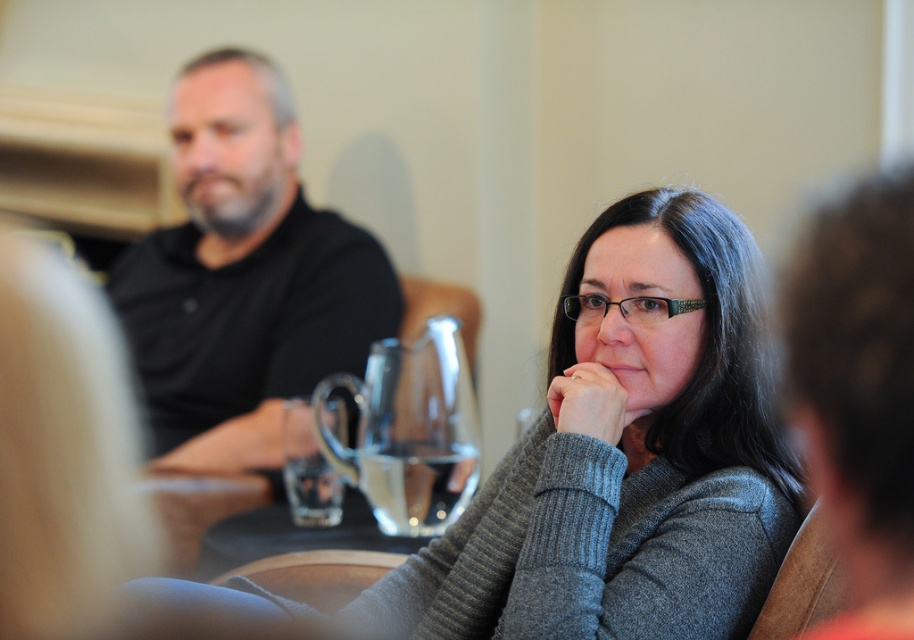
You are a photographer trying to capture a closeup of the transparent glass pitcher at center without including the gray knitted sweater at center in the frame. Based on their positions, is this possible?

The gray knitted sweater at center is to the right of the transparent glass pitcher at center, so if you position your camera to the left side of the pitcher, you can capture the pitcher without including the sweater on the right side.

You are a delivery robot that is 1 meter wide. You need to move from the gray knitted sweater at center to the black matte shirt at upper left. Can you fit through the space between them?

The distance between the gray knitted sweater at center and the black matte shirt at upper left is 1.32 meters. Since the robot is 1 meter wide, it can fit through the space between them as the distance is wider than the robot.

Looking at this image, you are a photographer trying to capture a clear shot of the black matte shirt at upper left and the transparent glass pitcher at center. Which object should you focus on to ensure it appears sharp in the final image?

The black matte shirt at upper left is much taller than the transparent glass pitcher at center, so focusing on the black matte shirt at upper left would ensure it appears sharp since it is larger in the frame.